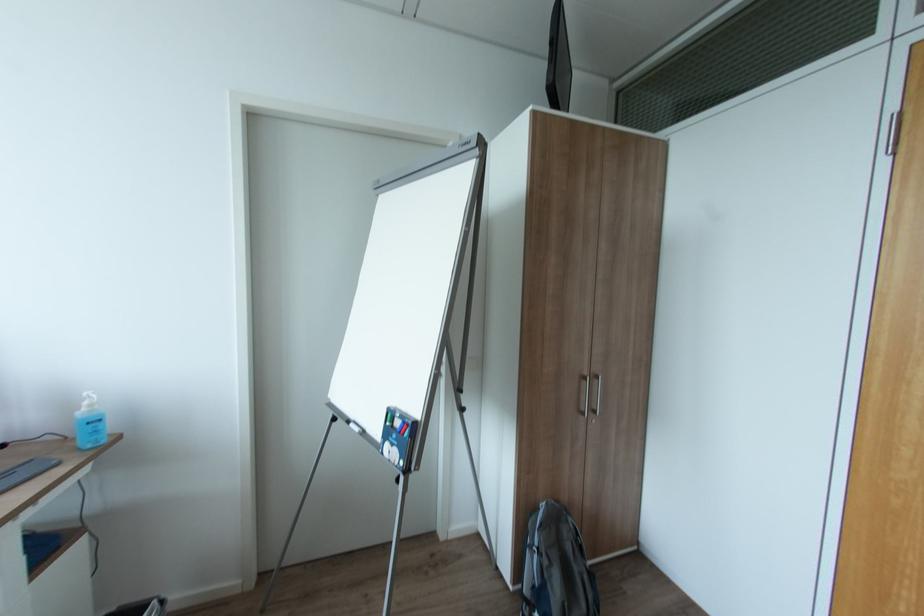
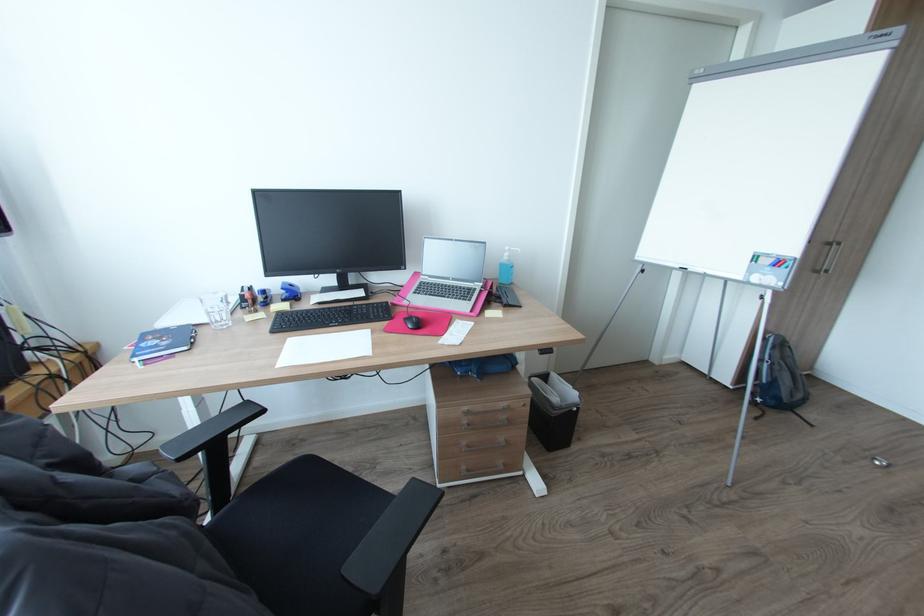
In a continuous first-person perspective shot, in which direction is the camera moving?

The cameraman moved toward left, backward.